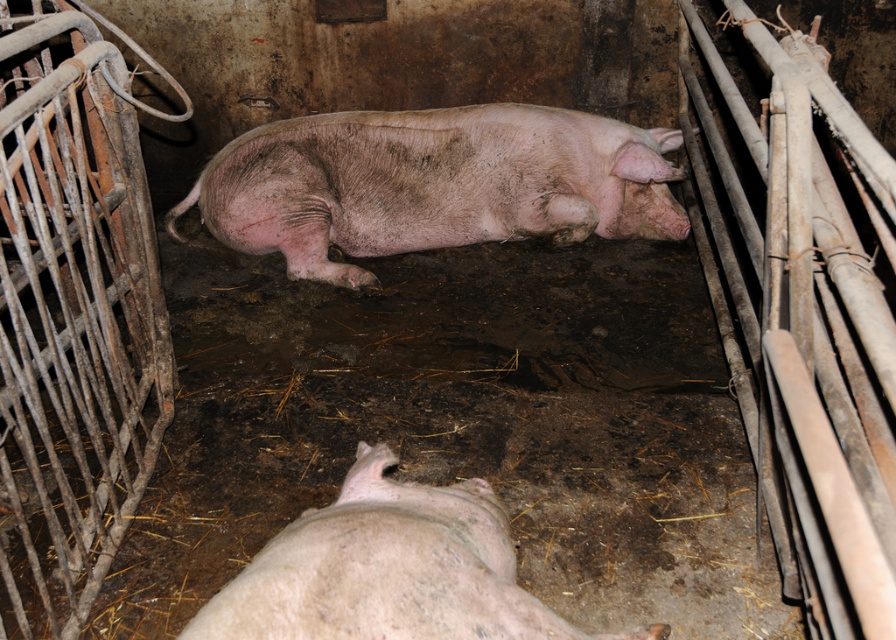
In the scene shown: You are standing at the entrance of the pigsty and see the pink matte pig at center. If you move 0.1 units to the right along the x axis, will you be closer to the pig?

The pink matte pig at center is located at point [432,182]. Moving 0.1 units to the right along the x axis would take you to x coordinate 0.387, which is further away from the pig along the x axis. Therefore, you will not be closer to the pig.

From the picture: You are a farmer checking on the pigs in the enclosure. You notice two pigs, the pink matte pig at center and the pink matte pig at lower center. Which pig is closer to the entrance of the enclosure?

The pink matte pig at center is closer to the entrance of the enclosure because the pink matte pig at lower center is behind it, meaning the latter is farther away from the entrance.

You are a farmer checking the pigs in the enclosure. You see the pink matte pig at center and the pink matte pig at lower center. Which pig is positioned higher in the enclosure?

The pink matte pig at center is positioned higher in the enclosure because it is above the pink matte pig at lower center.